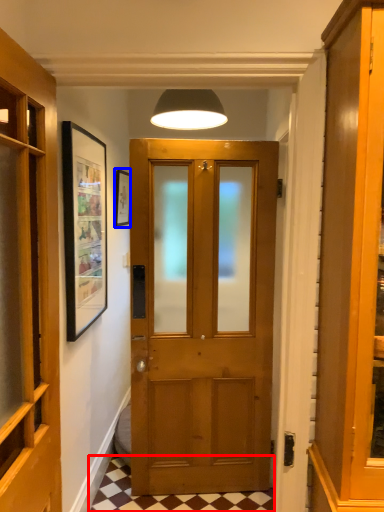
Question: Which object appears closest to the camera in this image, tile (highlighted by a red box) or picture frame (highlighted by a blue box)?

Choices:
 (A) tile
 (B) picture frame

Answer: (A)